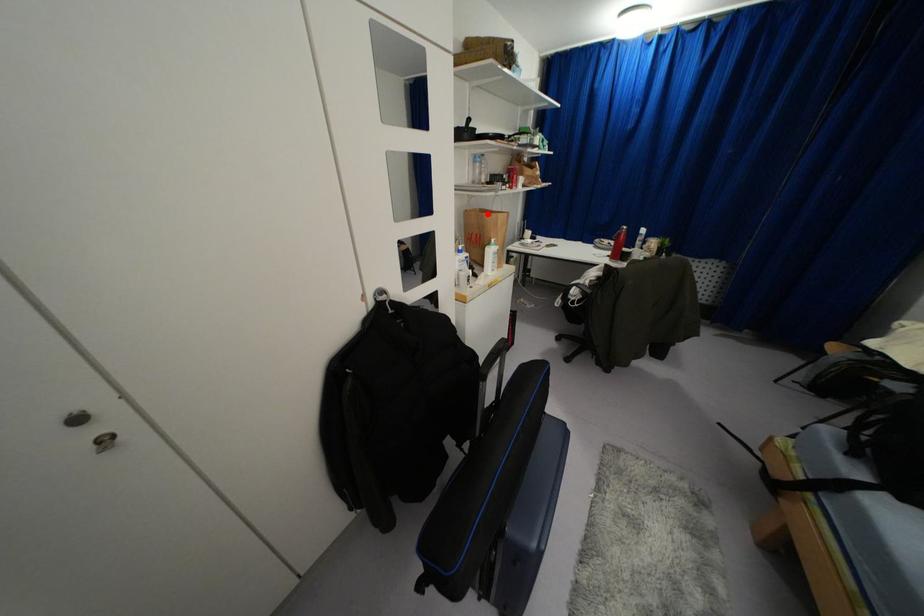
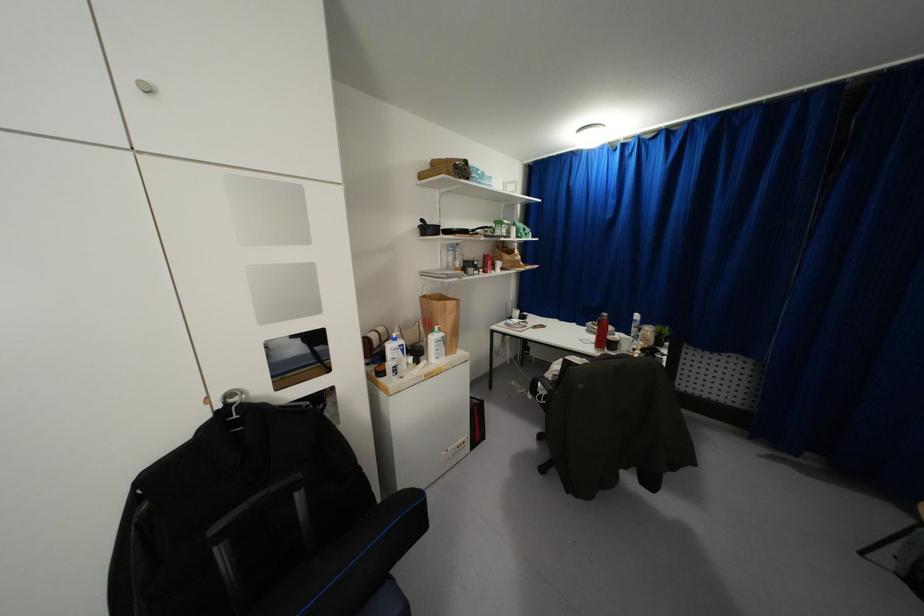
Question: A red point is marked in image1. In image2, is the corresponding 3D point closer to the camera or farther? Reply with the corresponding letter.

Choices:
 (A) The corresponding 3D point is closer.
 (B) The corresponding 3D point is farther.

Answer: (B)